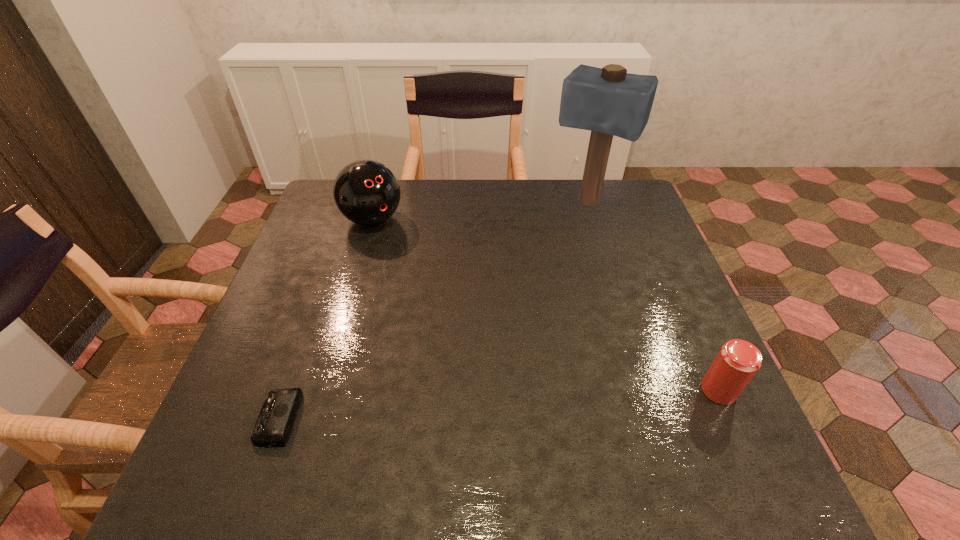
The width and height of the screenshot is (960, 540). Identify the location of free space on the desktop that is between the shortest object and the third tallest object and is positioned on the surface of the third shortest object near the finger holes. (561, 401).

Where is `vacant space on the desktop that is between the alarm clock and the third tallest object and is positioned on the striking surface of the tallest object`? vacant space on the desktop that is between the alarm clock and the third tallest object and is positioned on the striking surface of the tallest object is located at coordinates (467, 407).